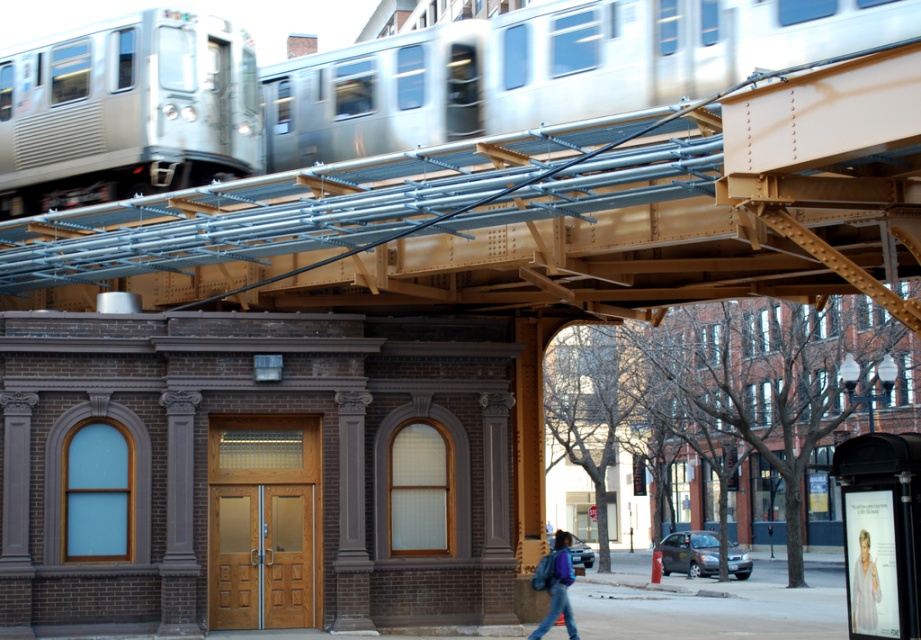
Question: Does silver metallic train at upper center have a greater width compared to blue fabric backpack at center?

Choices:
 (A) yes
 (B) no

Answer: (A)

Question: Considering the real-world distances, which object is closest to the silver metallic train at upper center?

Choices:
 (A) blue fabric backpack at center
 (B) silver metallic train at upper left

Answer: (B)

Question: Which object is the farthest from the silver metallic train at upper left?

Choices:
 (A) silver metallic train at upper center
 (B) blue fabric backpack at center

Answer: (B)

Question: Does silver metallic train at upper center have a smaller size compared to silver metallic train at upper left?

Choices:
 (A) yes
 (B) no

Answer: (B)

Question: Is silver metallic train at upper left above blue fabric backpack at center?

Choices:
 (A) yes
 (B) no

Answer: (A)

Question: Which of the following is the farthest from the observer?

Choices:
 (A) blue fabric backpack at center
 (B) silver metallic train at upper center

Answer: (A)